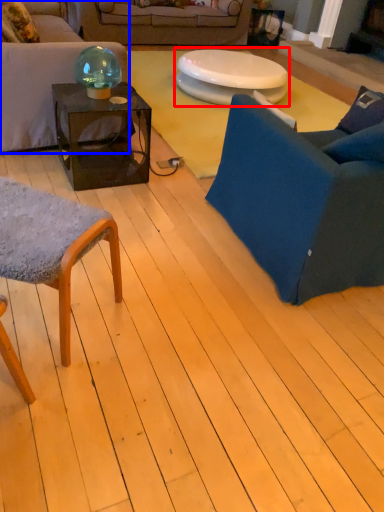
Question: Which point is further to the camera, table (highlighted by a red box) or studio couch (highlighted by a blue box)?

Choices:
 (A) table
 (B) studio couch

Answer: (A)